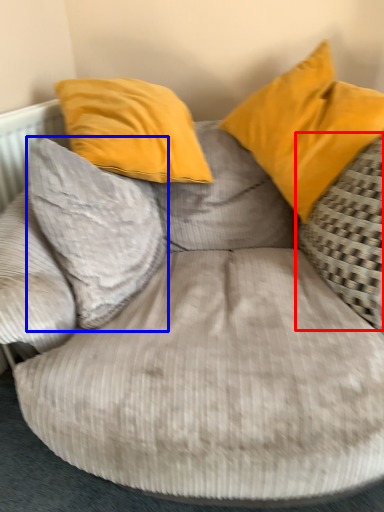
Question: Which object appears closest to the camera in this image, pillow (highlighted by a red box) or pillow (highlighted by a blue box)?

Choices:
 (A) pillow
 (B) pillow

Answer: (A)